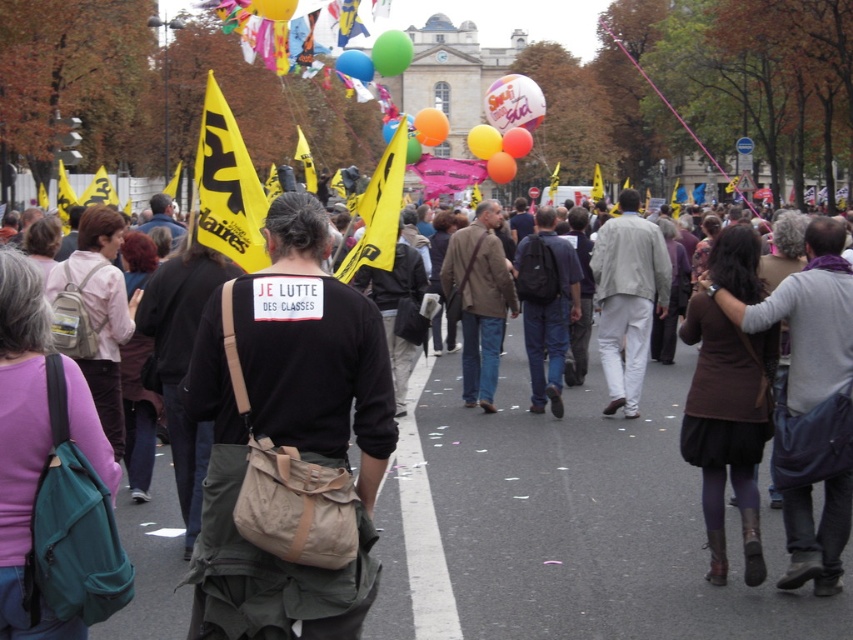
You are a photographer standing at the edge of the protest crowd. You want to take a photo that includes both the green rubber balloon at center and the translucent pink balloon at center. Which balloon should you focus on first to ensure both are in the frame?

You should focus on the green rubber balloon at center first because it is closer to you than the translucent pink balloon at center, ensuring both will be in the frame when properly focused.

You are a photographer standing in the middle of the protest. You see the green rubber balloon at center and the orange matte balloon at center. Which balloon is closer to you?

The green rubber balloon at center is closer to the viewer than the orange matte balloon at center.

You are a photographer standing at the edge of the protest, and you want to capture a closeup shot of the yellow rubber balloon at center. Given that your camera has a maximum zoom range of 100 meters, can you get a clear closeup of the balloon?

The yellow rubber balloon at center is 132.83 meters away from viewer. Since the camera can only zoom up to 100 meters, the balloon is too far away to capture a clear closeup.